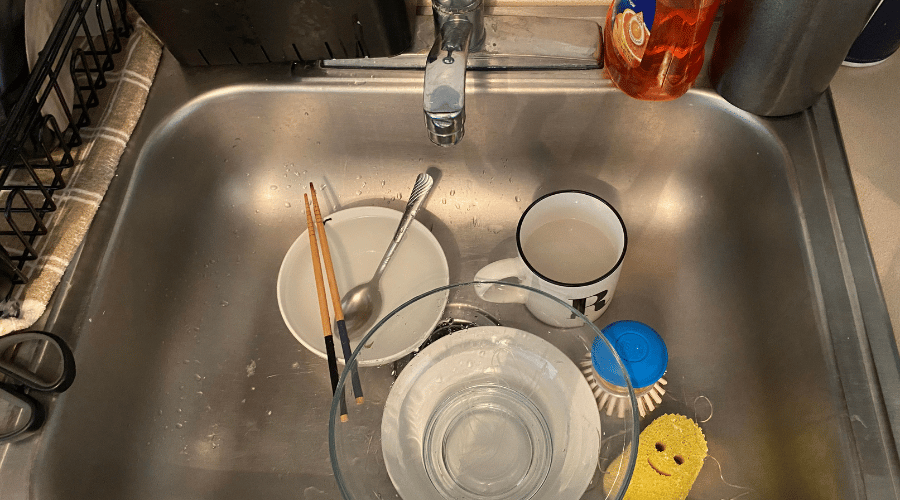
Where is `chopsticks`? chopsticks is located at coordinates (316, 249), (328, 254).